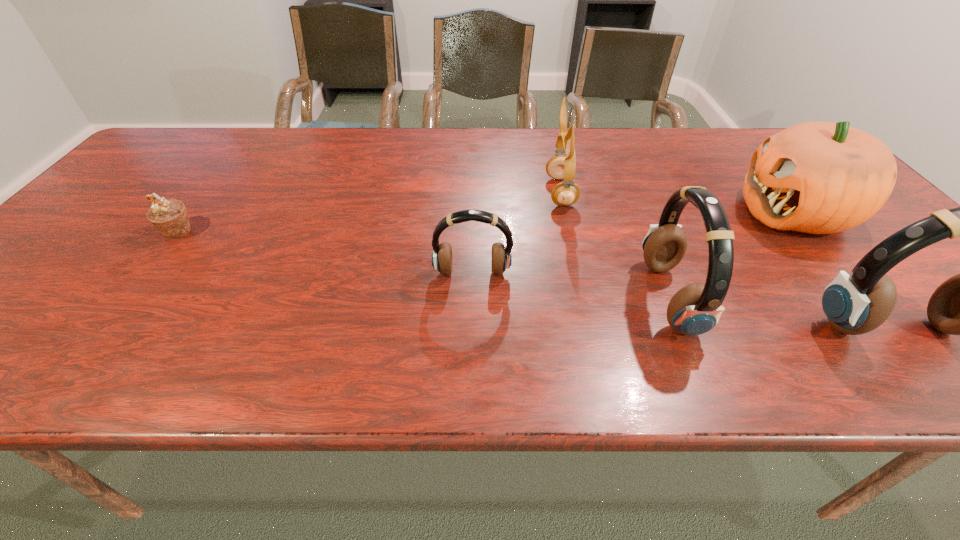
With all headsets evenly spaced, where should an extra headset be placed on the left to continue the pattern? Please point out a vacant space. Please provide its 2D coordinates. Your answer should be formatted as a tuple, i.e. [(x, y)], where the tuple contains the x and y coordinates of a point satisfying the conditions above.

[(297, 249)]